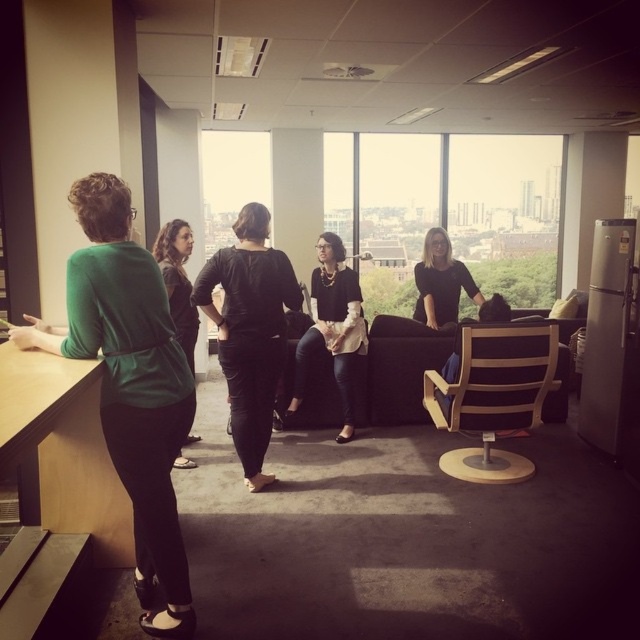
You are a photographer standing in the office scene. You want to take a closeup photo of the green matte blouse at left. Can you get within 2 meters to take the photo?

The green matte blouse at left is 1.99 meters from camera, so yes, you can get within 2 meters to take the photo.